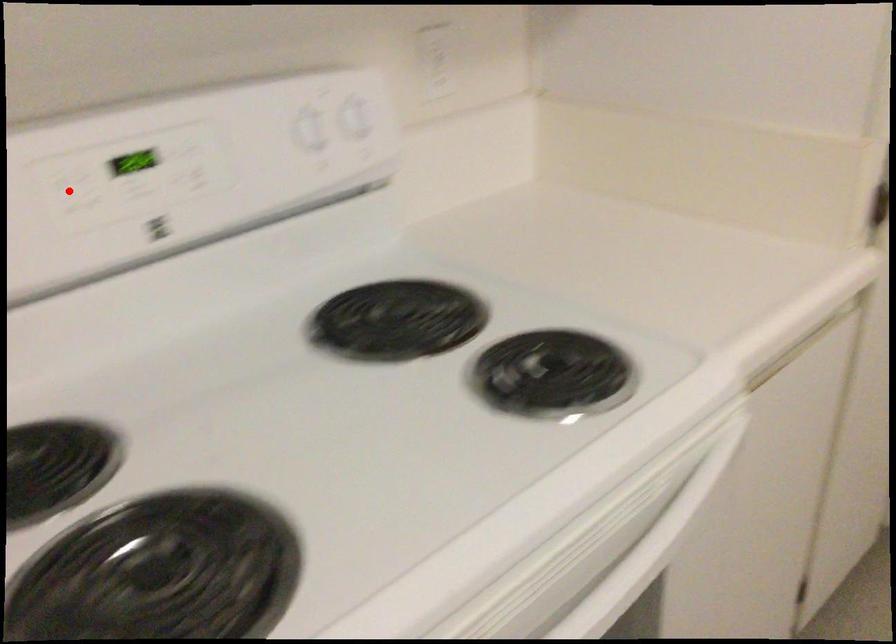
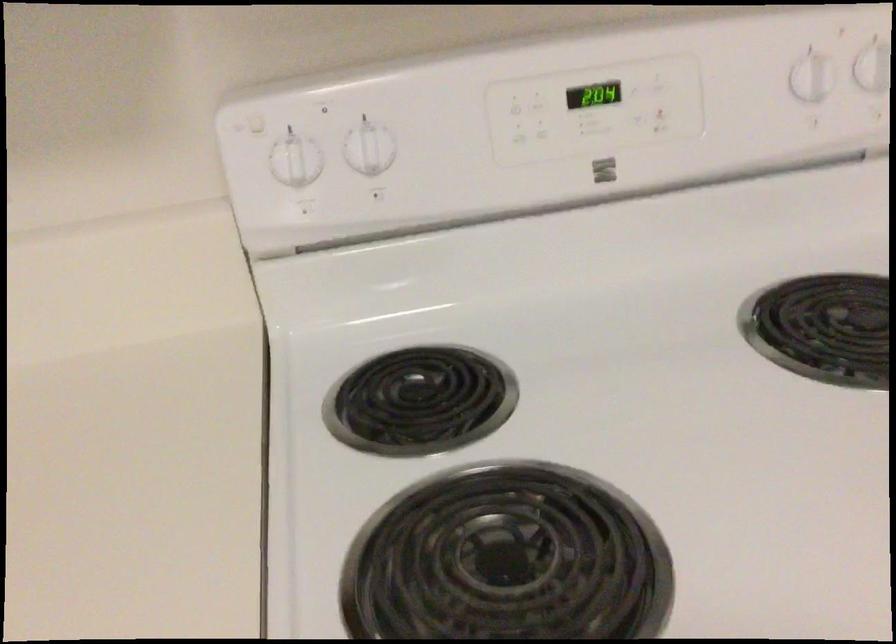
The point at the highlighted location is marked in the first image. Where is the corresponding point in the second image?

(515, 108)